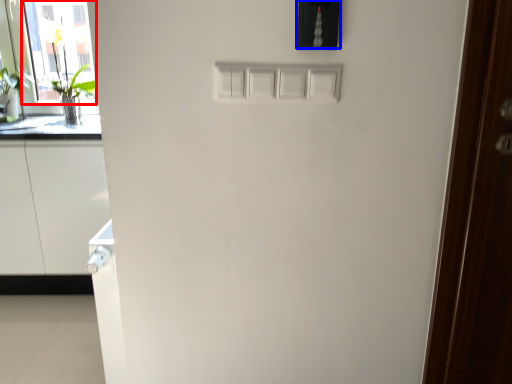
Question: Which object appears farthest to the camera in this image, glass door (highlighted by a red box) or light switch (highlighted by a blue box)?

Choices:
 (A) glass door
 (B) light switch

Answer: (A)